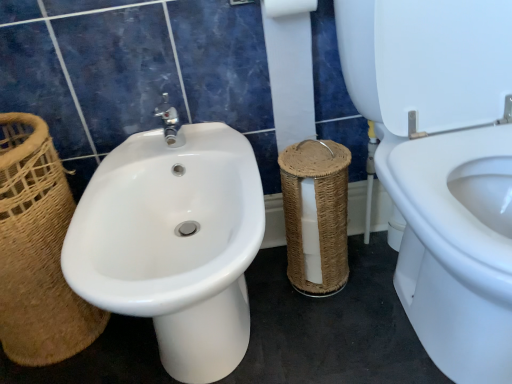
Question: Should I look upward or downward to see white paper at center?

Choices:
 (A) down
 (B) up

Answer: (B)

Question: Is white glossy bidet at center at the right side of white paper at center?

Choices:
 (A) no
 (B) yes

Answer: (A)

Question: Can you confirm if white glossy bidet at center is thinner than white paper at center?

Choices:
 (A) no
 (B) yes

Answer: (A)

Question: From the image's perspective, is white glossy bidet at center beneath white paper at center?

Choices:
 (A) no
 (B) yes

Answer: (B)

Question: Is white glossy bidet at center outside white paper at center?

Choices:
 (A) no
 (B) yes

Answer: (B)

Question: Is white glossy bidet at center smaller than white paper at center?

Choices:
 (A) no
 (B) yes

Answer: (A)

Question: From a real-world perspective, is white glossy bidet at center located higher than white paper at center?

Choices:
 (A) no
 (B) yes

Answer: (A)

Question: From a real-world perspective, is white paper at center physically above white glossy bidet at left?

Choices:
 (A) yes
 (B) no

Answer: (A)

Question: Is white paper at center next to white glossy bidet at left?

Choices:
 (A) yes
 (B) no

Answer: (B)

Question: Is white glossy bidet at left inside white paper at center?

Choices:
 (A) yes
 (B) no

Answer: (B)

Question: Is white paper at center not near white glossy bidet at left?

Choices:
 (A) yes
 (B) no

Answer: (B)

Question: Can you confirm if white paper at center is shorter than white glossy bidet at left?

Choices:
 (A) yes
 (B) no

Answer: (A)

Question: Is white paper at center behind white glossy bidet at left?

Choices:
 (A) no
 (B) yes

Answer: (B)

Question: Is white paper at center completely or partially inside white glossy bidet at left?

Choices:
 (A) yes
 (B) no

Answer: (B)